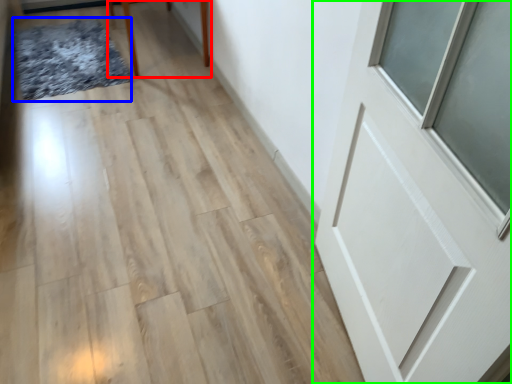
Question: Which object is the closest to the furniture (highlighted by a red box)? Choose among these: mat (highlighted by a blue box) or door (highlighted by a green box).

Choices:
 (A) mat
 (B) door

Answer: (A)